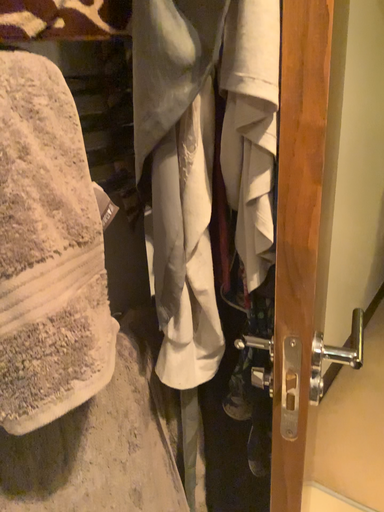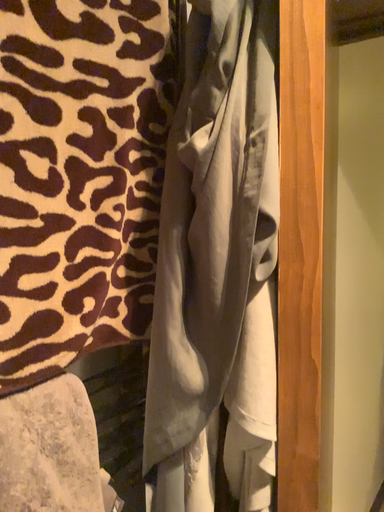
Question: Which way did the camera rotate in the video?

Choices:
 (A) rotated downward
 (B) rotated upward

Answer: (B)